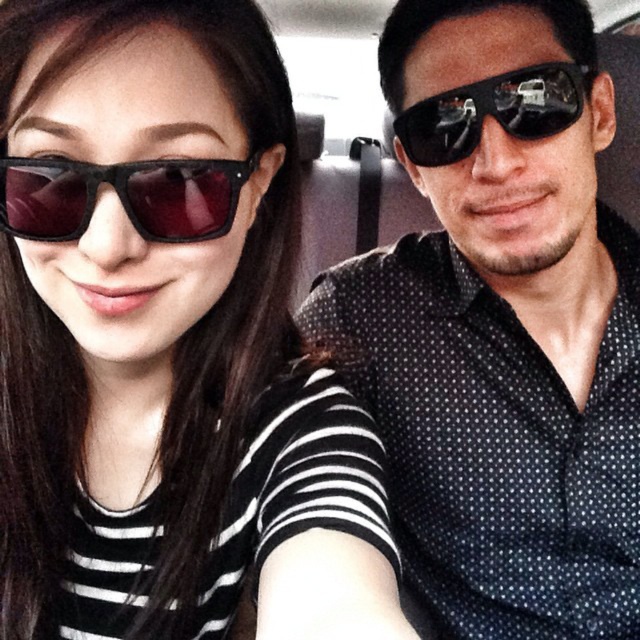
You are a photographer setting up a shoot in a car. You need to position two matte black sunglasses in the frame. According to the scene, where should you place the matte black sunglasses at upper left and the matte black sunglasses at left to match the original image?

Place the matte black sunglasses at left on the left side of the frame. Then position the matte black sunglasses at upper left to the right of the matte black sunglasses at left to match the original image.

You are a photographer trying to capture a clear shot of both the matte black sunglasses at upper left and the matte black sunglasses at left. Since you want to focus on the sunglasses at left, which one should be placed closer to the camera?

The matte black sunglasses at upper left is in front of the matte black sunglasses at left, so to focus on the sunglasses at left, you need to move the matte black sunglasses at upper left out of the way so the matte black sunglasses at left can be closer to the camera.